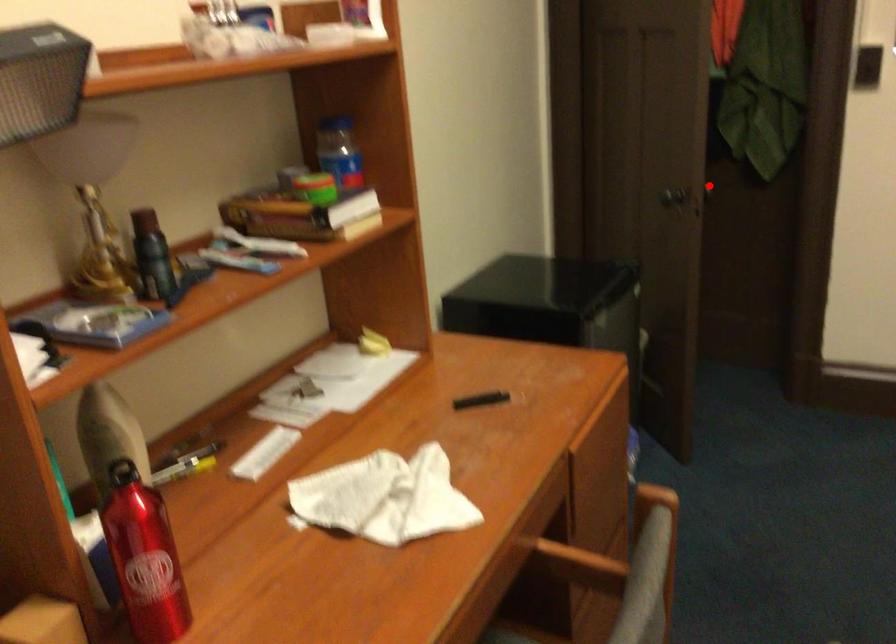
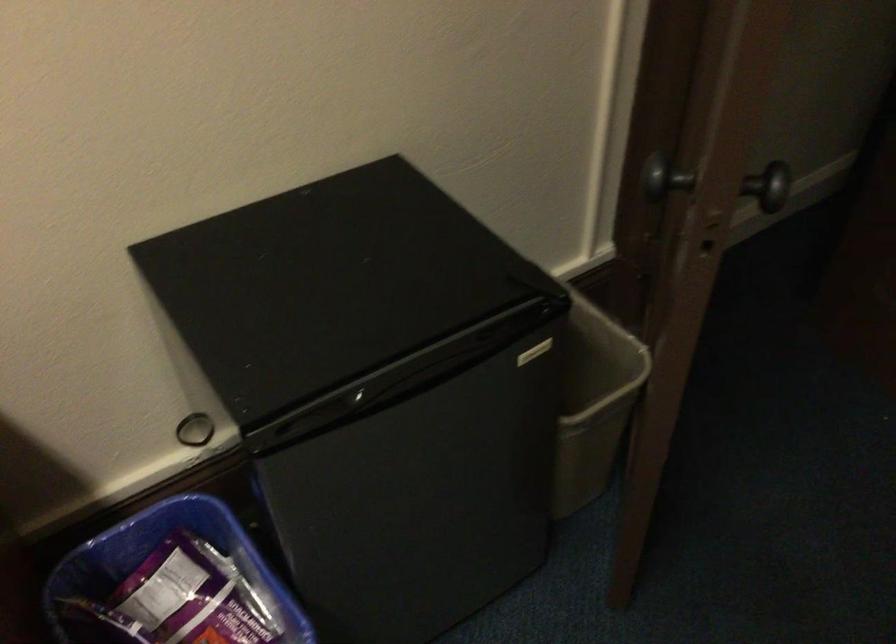
Question: A red point is marked in image1. In image2, is the corresponding 3D point closer to the camera or farther? Reply with the corresponding letter.

Choices:
 (A) The corresponding 3D point is closer.
 (B) The corresponding 3D point is farther.

Answer: (A)